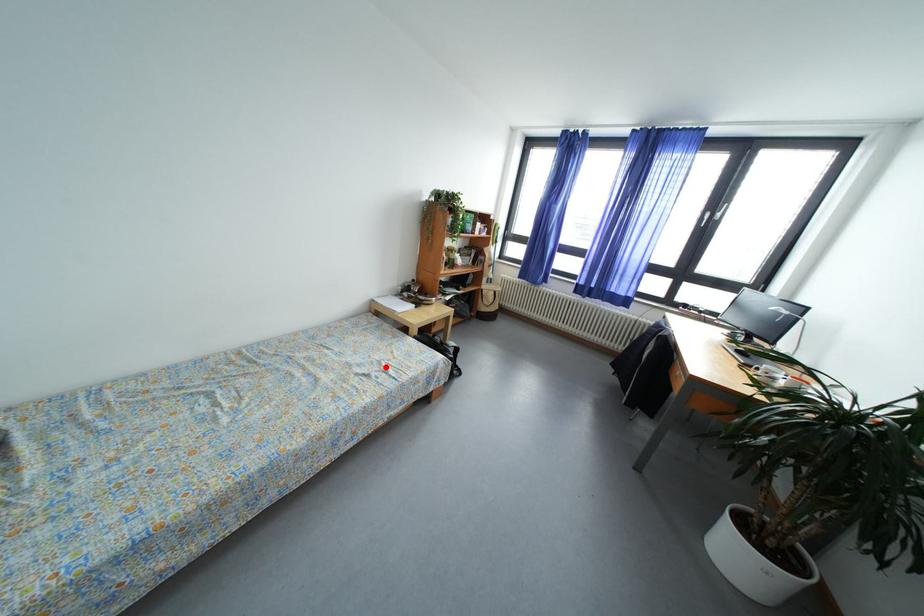
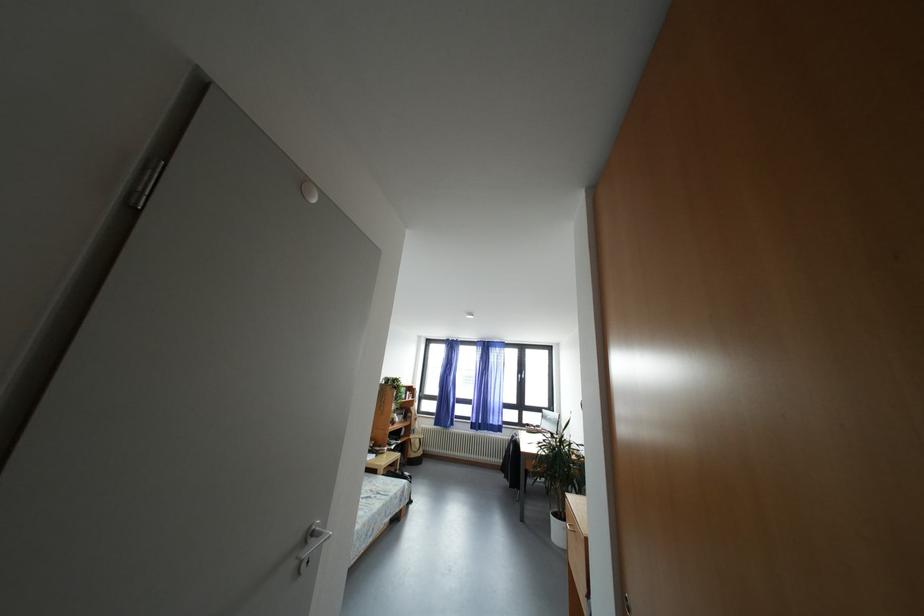
Question: I am providing you with two images of the same scene from different viewpoints. Given a red point in image1, look at the same physical point in image2. Is it:

Choices:
 (A) Closer to the viewpoint
 (B) Farther from the viewpoint

Answer: (A)